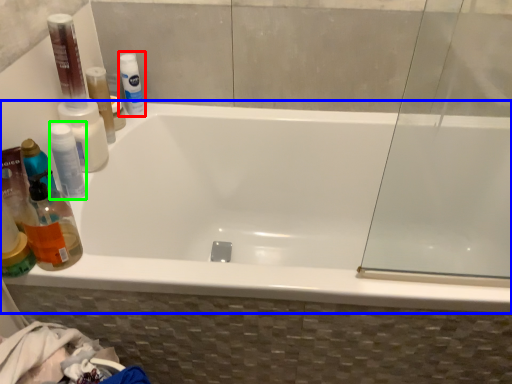
Question: Considering the real-world distances, which object is farthest from mouthwash (highlighted by a red box)? bathtub (highlighted by a blue box) or mouthwash (highlighted by a green box)?

Choices:
 (A) bathtub
 (B) mouthwash

Answer: (A)